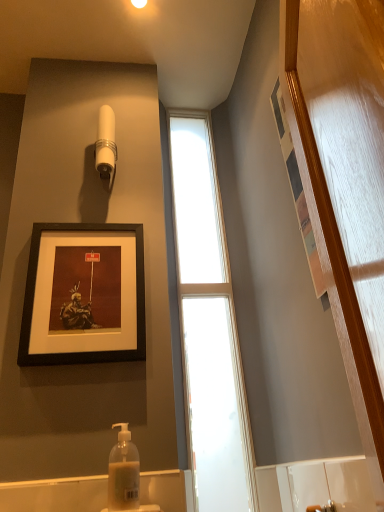
Question: Does point (112, 157) appear closer or farther from the camera than point (205, 142)?

Choices:
 (A) farther
 (B) closer

Answer: (B)

Question: From the image's perspective, relative to clear glass window at center, is white plastic shower head at upper center above or below?

Choices:
 (A) above
 (B) below

Answer: (A)

Question: Which of these objects is positioned closest to the matte black frame at upper center?

Choices:
 (A) translucent plastic soap dispenser at lower center
 (B) clear glass window at center
 (C) white plastic shower head at upper center

Answer: (A)

Question: Which is farther from the translucent plastic soap dispenser at lower center?

Choices:
 (A) matte black frame at upper center
 (B) clear glass window at center
 (C) white plastic shower head at upper center

Answer: (C)